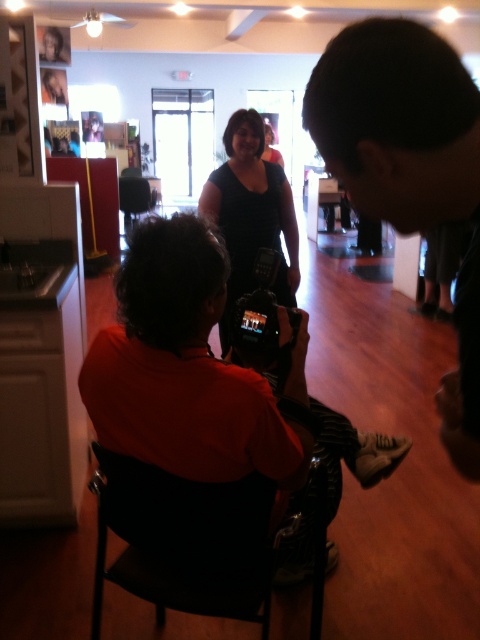
Consider the image. Is dark brown hair at center shorter than matte black dress at center?

Correct, dark brown hair at center is not as tall as matte black dress at center.

Identify the location of dark brown hair at center. (409, 170).

What do you see at coordinates (409, 170) in the screenshot? I see `dark brown hair at center` at bounding box center [409, 170].

Between point (338, 166) and point (210, 490), which one is positioned in front?

Positioned in front is point (338, 166).

Identify the location of dark brown hair at center. (409, 170).

Is matte black dress at center above black plastic video camera at center?

Correct, matte black dress at center is located above black plastic video camera at center.

Consider the image. How distant is matte black dress at center from black plastic video camera at center?

matte black dress at center is 3.46 feet from black plastic video camera at center.

The height and width of the screenshot is (640, 480). What do you see at coordinates (251, 212) in the screenshot? I see `matte black dress at center` at bounding box center [251, 212].

This screenshot has width=480, height=640. In order to click on matte black dress at center in this screenshot , I will do `click(251, 212)`.